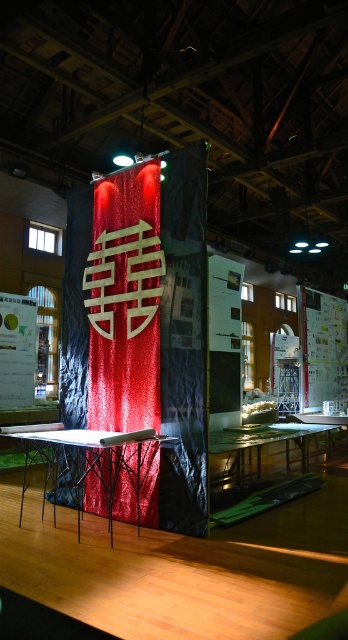
Question: Does shiny sequined curtain at center have a smaller size compared to metallic silver table at center?

Choices:
 (A) yes
 (B) no

Answer: (A)

Question: Does shiny sequined curtain at center have a smaller size compared to clear glass table at center?

Choices:
 (A) no
 (B) yes

Answer: (B)

Question: Which object is positioned closest to the shiny sequined curtain at center?

Choices:
 (A) metallic silver table at center
 (B) clear glass table at center

Answer: (A)

Question: Observing the image, what is the correct spatial positioning of shiny sequined curtain at center in reference to metallic silver table at center?

Choices:
 (A) above
 (B) below

Answer: (A)

Question: Which is farther from the clear glass table at center?

Choices:
 (A) shiny sequined curtain at center
 (B) metallic silver table at center

Answer: (A)

Question: Which point is closer to the camera?

Choices:
 (A) shiny sequined curtain at center
 (B) clear glass table at center

Answer: (B)